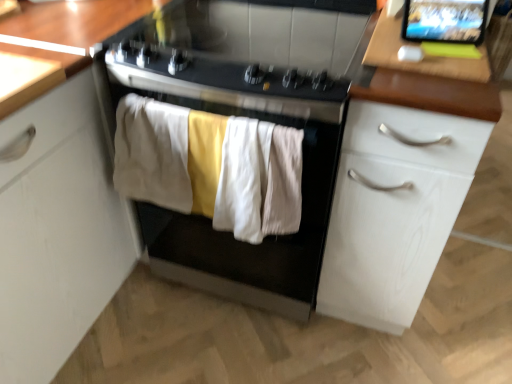
You are a GUI agent. You are given a task and a screenshot of the screen. Output one action in this format:
    pyautogui.click(x=<x>, y=<y>)
    Task: Click on the free location in front of black matte oven at center
    The height and width of the screenshot is (384, 512).
    Given the screenshot: What is the action you would take?
    pyautogui.click(x=229, y=349)